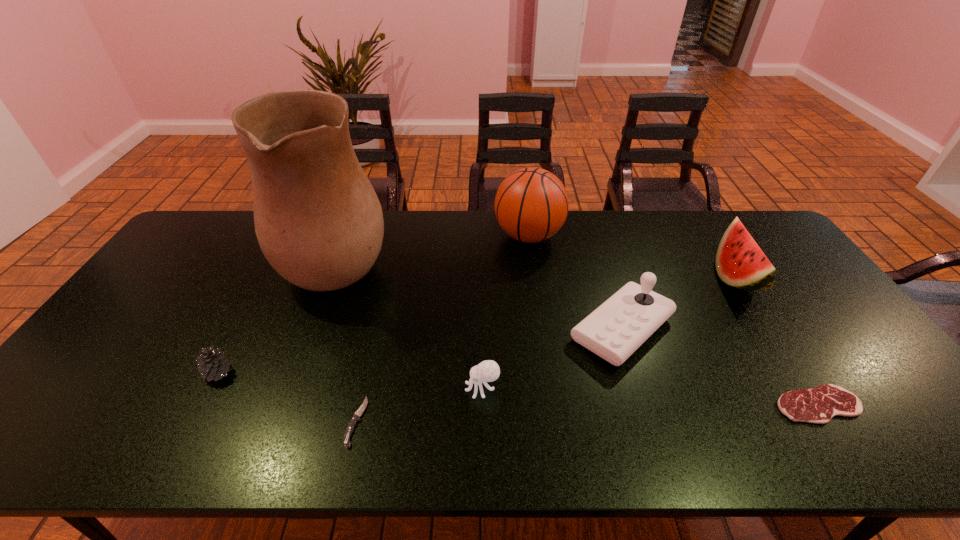
The height and width of the screenshot is (540, 960). I want to click on cream pitcher located in the far edge section of the desktop, so click(x=319, y=223).

Locate an element on the screen. basketball that is at the far edge is located at coordinates (531, 204).

Image resolution: width=960 pixels, height=540 pixels. In order to click on watermelon at the far edge in this screenshot , I will do `click(740, 262)`.

Find the location of a particular element. The image size is (960, 540). steak at the near edge is located at coordinates (819, 405).

Find the location of a particular element. The height and width of the screenshot is (540, 960). pocketknife situated at the near edge is located at coordinates (350, 428).

At what (x,y) coordinates should I click in order to perform the action: click on object that is at the right edge. Please return your answer as a coordinate pair (x, y). Looking at the image, I should click on (819, 405).

Identify the location of object situated at the near right corner. The width and height of the screenshot is (960, 540). (819, 405).

You are a GUI agent. You are given a task and a screenshot of the screen. Output one action in this format:
    pyautogui.click(x=<x>, y=<y>)
    Task: Click on the vacant space at the far edge of the desktop
    
    Given the screenshot: What is the action you would take?
    pyautogui.click(x=610, y=226)

This screenshot has width=960, height=540. Find the location of `free space at the near edge`. free space at the near edge is located at coordinates (403, 443).

This screenshot has height=540, width=960. What are the coordinates of `vacant space at the left edge of the desktop` in the screenshot? It's located at (92, 376).